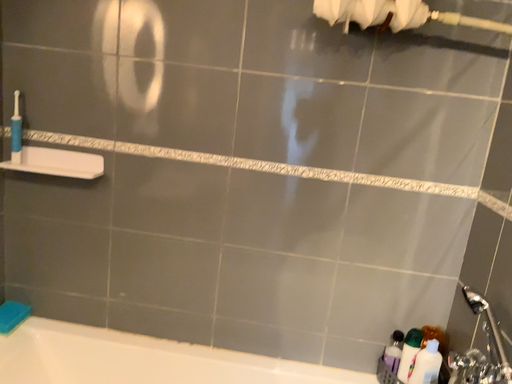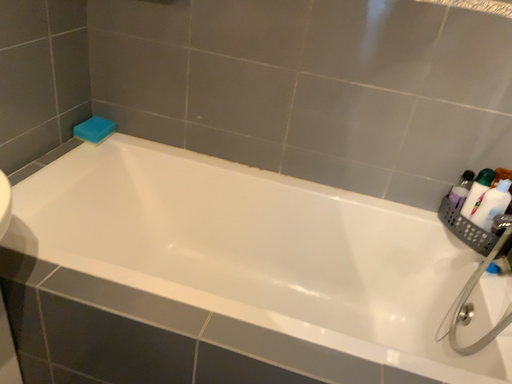
Question: Which way did the camera rotate in the video?

Choices:
 (A) rotated upward
 (B) rotated downward

Answer: (B)